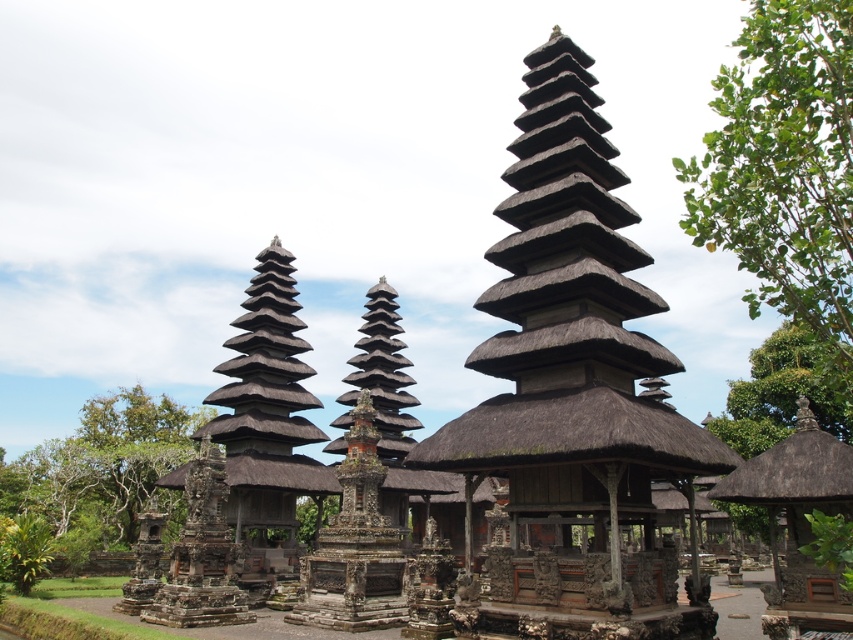
Question: Is dark brown thatched roof tower at center wider than green leafy tree at lower left?

Choices:
 (A) yes
 (B) no

Answer: (B)

Question: Does dark brown thatched roof tower at center lie in front of green leafy tree at lower left?

Choices:
 (A) yes
 (B) no

Answer: (A)

Question: Is dark brown thatched roof tower at center further to camera compared to green leafy tree at lower left?

Choices:
 (A) yes
 (B) no

Answer: (B)

Question: Which object appears farthest from the camera in this image?

Choices:
 (A) dark brown thatched roof tower at center
 (B) green leafy tree at lower left

Answer: (B)

Question: Among these points, which one is nearest to the camera?

Choices:
 (A) (485, 403)
 (B) (171, 433)

Answer: (A)